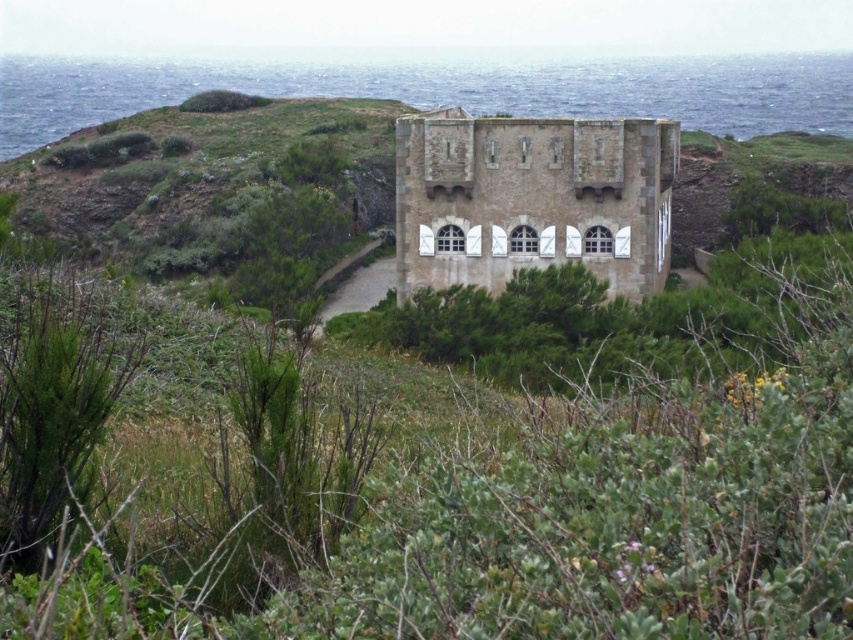
Between point (51, 115) and point (489, 193), which one is positioned behind?

The point (51, 115) is more distant.

Between blue water at center and brown stone castle at center, which one is positioned lower?

brown stone castle at center is lower down.

Between point (572, 93) and point (498, 157), which one is positioned in front?

Point (498, 157)

Where is `blue water at center`? blue water at center is located at coordinates (444, 88).